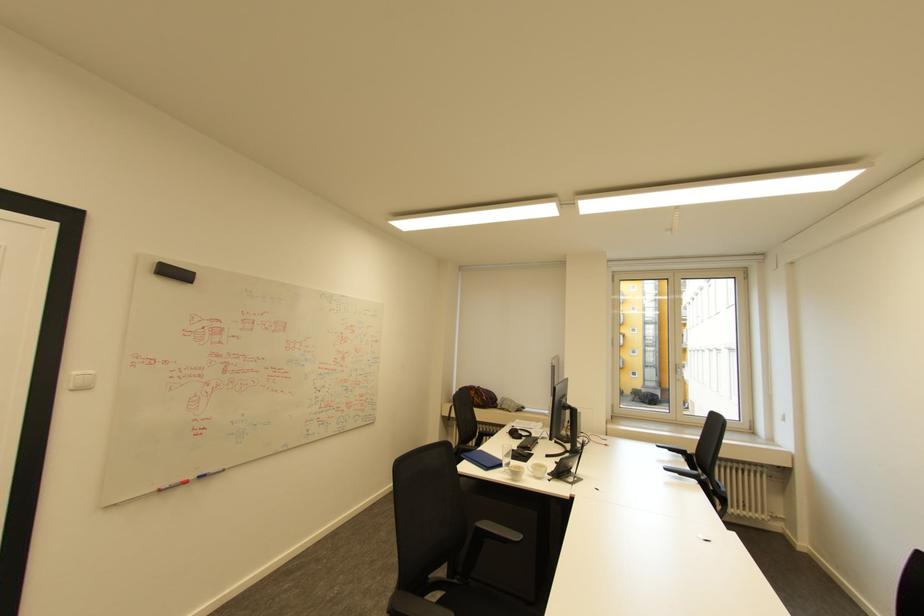
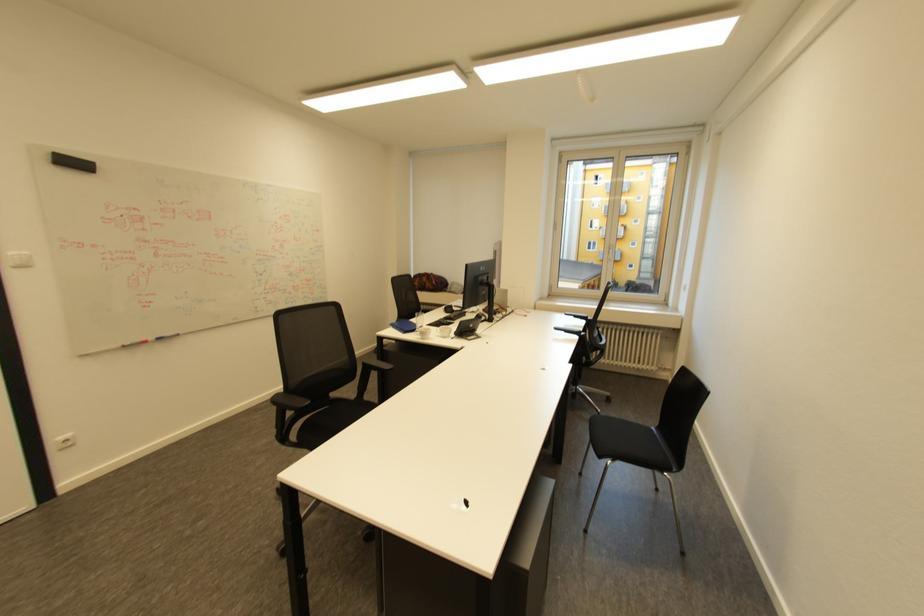
The point at (207,477) is marked in the first image. Where is the corresponding point in the second image?

(164, 339)